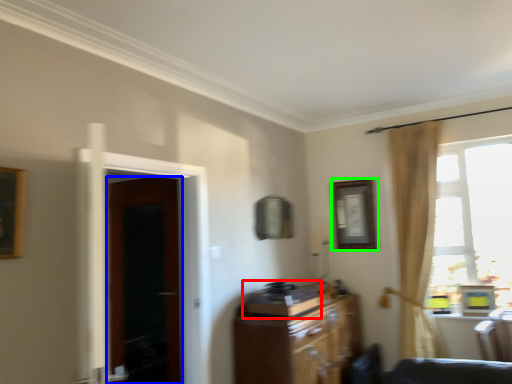
Question: Which object is the closest to the appliance (highlighted by a red box)? Choose among these: door (highlighted by a blue box) or picture frame (highlighted by a green box).

Choices:
 (A) door
 (B) picture frame

Answer: (B)